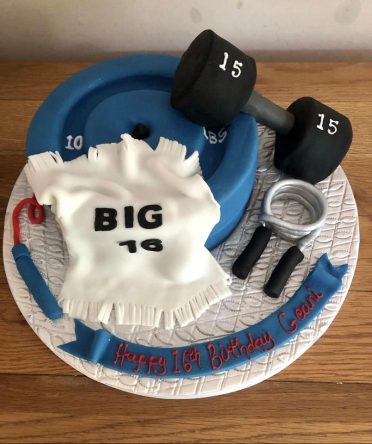
Where is `birthday cake`? The image size is (372, 444). birthday cake is located at coordinates (225, 241).